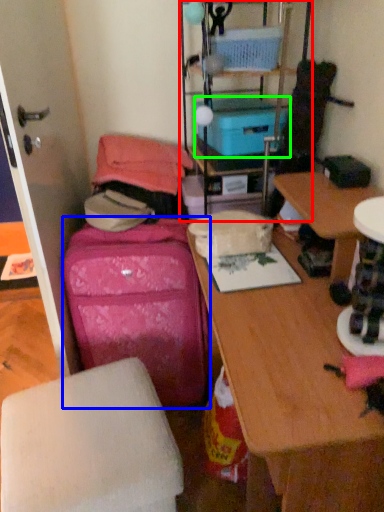
Question: Which object is the closest to the shelf (highlighted by a red box)? Choose among these: luggage (highlighted by a blue box) or storage box (highlighted by a green box).

Choices:
 (A) luggage
 (B) storage box

Answer: (B)